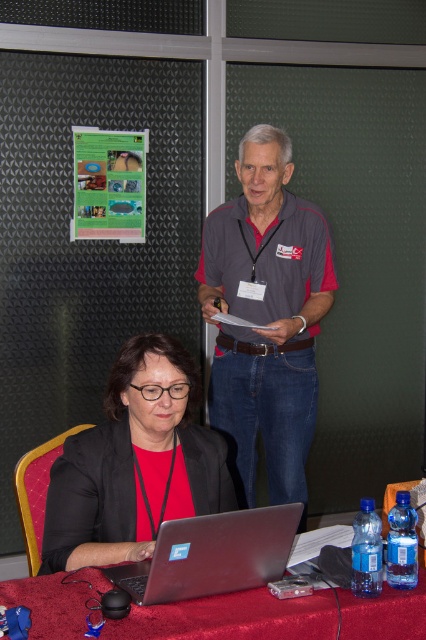
Question: Considering the relative positions of gray/denim shirt at center and matte plastic bulletin board at upper left in the image provided, where is gray/denim shirt at center located with respect to matte plastic bulletin board at upper left?

Choices:
 (A) below
 (B) above

Answer: (A)

Question: Is matte black jacket at lower left bigger than matte plastic bulletin board at upper left?

Choices:
 (A) no
 (B) yes

Answer: (B)

Question: Which of the following is the closest to the observer?

Choices:
 (A) matte plastic bulletin board at upper left
 (B) red velvet tablecloth at lower center
 (C) matte black jacket at lower left

Answer: (B)

Question: Which of the following is the closest to the observer?

Choices:
 (A) matte plastic bulletin board at upper left
 (B) silver metallic laptop at lower center
 (C) red velvet tablecloth at lower center

Answer: (C)

Question: Does gray/denim shirt at center have a larger size compared to silver metallic laptop at lower center?

Choices:
 (A) yes
 (B) no

Answer: (A)

Question: Which point is closer to the camera taking this photo?

Choices:
 (A) (134, 138)
 (B) (215, 435)
 (C) (210, 561)

Answer: (C)